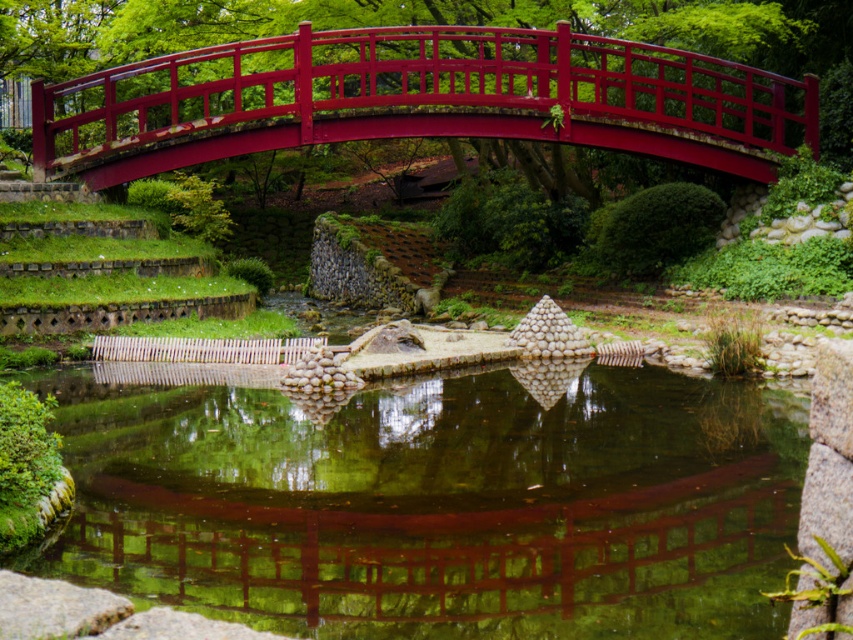
You are a visitor in the garden and want to cross the glossy wood bridge at upper center to reach the other side. However, you notice that the green reflective water at center is flowing beneath it. Do you think the bridge is wide enough for you to walk across safely?

The glossy wood bridge at upper center is wider than the green reflective water at center, so yes, the bridge is wide enough for you to walk across safely.

You are standing at the starting point of the stone pathway leading to the red wooden bridge in the Japanese garden. You see two points marked as point 1 at coordinates point [619,612] and point 2 at coordinates point [202,77]. Which point is closer to you as you stand at the pathway entrance?

Point 1 at coordinates point [619,612] is closer to you because it is in front of point 2 at coordinates point [202,77].

You are standing at the entrance of the garden and see the red wooden bridge and the green reflective water at center. Which object is exactly at the coordinates point (439, 502)?

The green reflective water at center is located at point (439, 502).